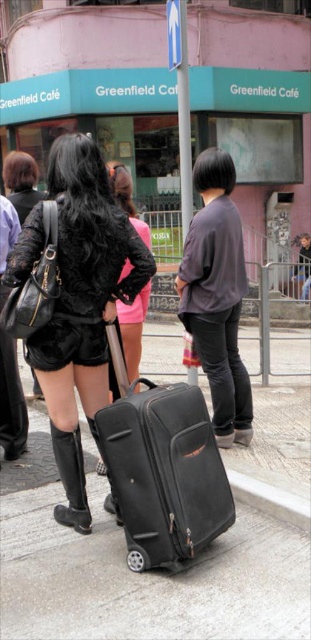
You are a photographer trying to capture the velvet black shorts at center and the black leather boot at lower left in a single frame. Based on their positions, which object will appear larger in the photo?

The velvet black shorts at center will appear larger in the photo because it is closer to the viewer compared to the black leather boot at lower left.